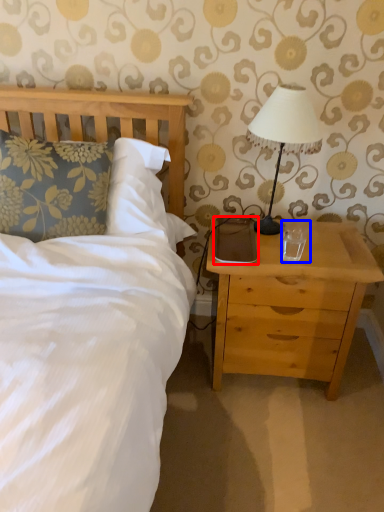
Question: Among these objects, which one is farthest to the camera, pad (highlighted by a red box) or coffee cup (highlighted by a blue box)?

Choices:
 (A) pad
 (B) coffee cup

Answer: (A)